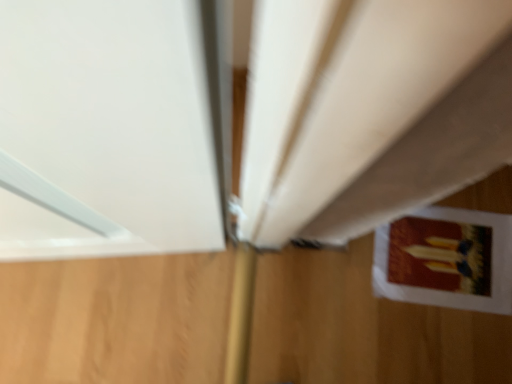
This screenshot has width=512, height=384. Describe the element at coordinates (446, 259) in the screenshot. I see `matte white picture frame at lower right` at that location.

What is the approximate height of matte white picture frame at lower right?

matte white picture frame at lower right is 2.17 centimeters in height.

Identify the location of matte white picture frame at lower right. This screenshot has width=512, height=384. (446, 259).

You are a GUI agent. You are given a task and a screenshot of the screen. Output one action in this format:
    pyautogui.click(x=<x>, y=<y>)
    Task: Click on the matte white picture frame at lower right
    The image size is (512, 384).
    Given the screenshot: What is the action you would take?
    pyautogui.click(x=446, y=259)